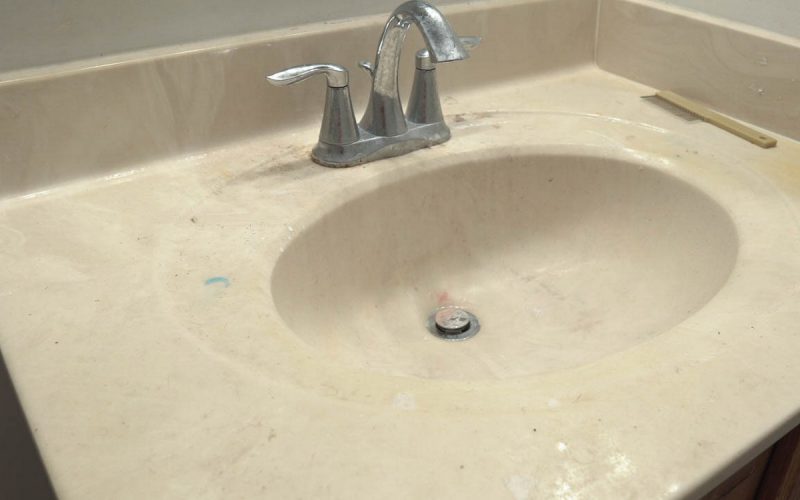
You are a GUI agent. You are given a task and a screenshot of the screen. Output one action in this format:
    pyautogui.click(x=<x>, y=<y>)
    Task: Click on the sink basin
    The image size is (800, 500).
    Given the screenshot: What is the action you would take?
    pyautogui.click(x=658, y=238)